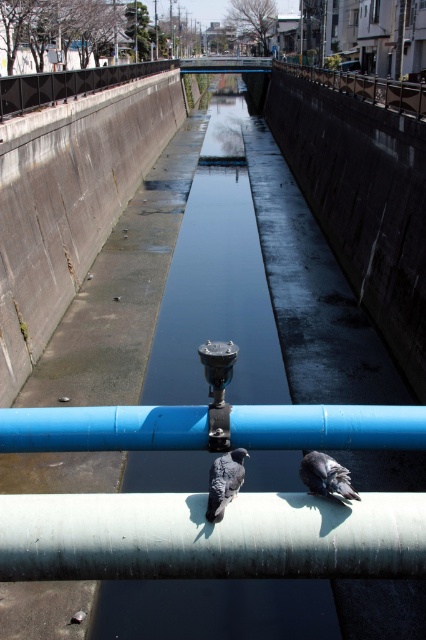
I want to click on white smooth water pipe at center, so click(210, 536).

How distant is white smooth water pipe at center from blue plastic pipe at center?

white smooth water pipe at center is 16.97 inches away from blue plastic pipe at center.

What do you see at coordinates (210, 536) in the screenshot? I see `white smooth water pipe at center` at bounding box center [210, 536].

Image resolution: width=426 pixels, height=640 pixels. In order to click on white smooth water pipe at center in this screenshot , I will do `click(210, 536)`.

Is smooth metal railing at upper center taller than shiny black bird at center?

Correct, smooth metal railing at upper center is much taller as shiny black bird at center.

Is point (344, 81) closer to viewer compared to point (314, 468)?

That is False.

Where is `smooth metal railing at upper center`? Image resolution: width=426 pixels, height=640 pixels. smooth metal railing at upper center is located at coordinates (365, 88).

Can you confirm if white smooth water pipe at center is taller than shiny black bird at center?

Yes, white smooth water pipe at center is taller than shiny black bird at center.

Does white smooth water pipe at center have a lesser height compared to shiny black bird at center?

No.

Find the location of `white smooth water pipe at center`. white smooth water pipe at center is located at coordinates (210, 536).